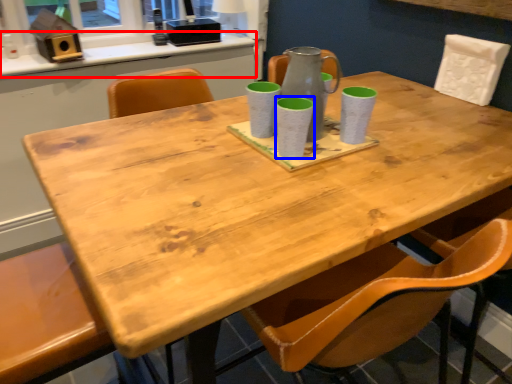
Question: Which object is closer to the camera taking this photo, counter top (highlighted by a red box) or mug (highlighted by a blue box)?

Choices:
 (A) counter top
 (B) mug

Answer: (B)